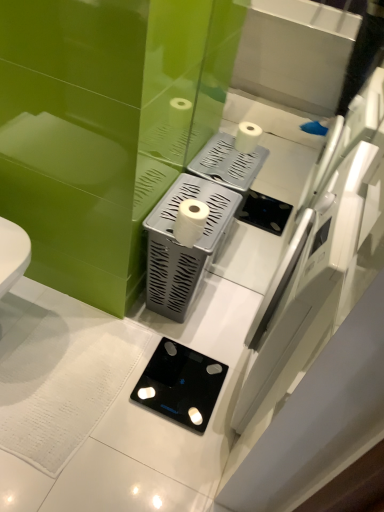
Question: Is silver textured tissue holder at center to the left of black glass scale at lower center from the viewer's perspective?

Choices:
 (A) no
 (B) yes

Answer: (A)

Question: Is silver textured tissue holder at center smaller than black glass scale at lower center?

Choices:
 (A) yes
 (B) no

Answer: (B)

Question: Considering the relative sizes of silver textured tissue holder at center and black glass scale at lower center in the image provided, is silver textured tissue holder at center bigger than black glass scale at lower center?

Choices:
 (A) no
 (B) yes

Answer: (B)

Question: Does silver textured tissue holder at center have a greater width compared to black glass scale at lower center?

Choices:
 (A) no
 (B) yes

Answer: (A)

Question: Can you confirm if silver textured tissue holder at center is thinner than black glass scale at lower center?

Choices:
 (A) no
 (B) yes

Answer: (B)

Question: From a real-world perspective, is silver textured tissue holder at center under black glass scale at lower center?

Choices:
 (A) no
 (B) yes

Answer: (A)

Question: Is black glass scale at lower center beside silver textured tissue holder at center?

Choices:
 (A) yes
 (B) no

Answer: (B)

Question: From a real-world perspective, is black glass scale at lower center over silver textured tissue holder at center?

Choices:
 (A) no
 (B) yes

Answer: (A)

Question: Considering the relative sizes of black glass scale at lower center and silver textured tissue holder at center in the image provided, is black glass scale at lower center taller than silver textured tissue holder at center?

Choices:
 (A) yes
 (B) no

Answer: (B)

Question: Can you confirm if black glass scale at lower center is smaller than silver textured tissue holder at center?

Choices:
 (A) yes
 (B) no

Answer: (A)

Question: From the image's perspective, is black glass scale at lower center below silver textured tissue holder at center?

Choices:
 (A) yes
 (B) no

Answer: (A)

Question: Is black glass scale at lower center positioned behind silver textured tissue holder at center?

Choices:
 (A) yes
 (B) no

Answer: (A)

Question: Is white matte toilet paper at center to the left of black glass scale at lower center from the viewer's perspective?

Choices:
 (A) yes
 (B) no

Answer: (B)